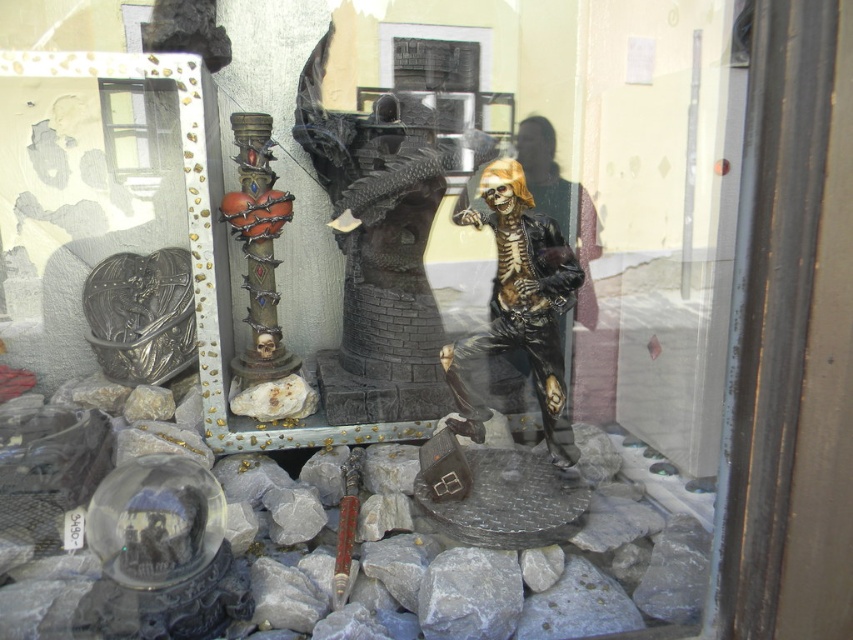
You are standing in front of the display case and want to touch both points in the scene. Which point, point [143,348] or point [277,300], will require you to reach further forward to touch it?

Point [277,300] will require reaching further forward because it is farther from the viewer compared to point [143,348].

You are a delivery person who needs to place a new item in the display case. The new item requires a space of at least 25 inches between the shiny gold skeleton at center and the shiny metallic column at center. Based on the scene description, can the new item be placed there?

The shiny gold skeleton at center is 25.65 inches from the shiny metallic column at center, so yes, the new item can be placed there since the required space of 25 inches is met.

You are a customer in a shop and want to buy the shiny gold skeleton at center and the shiny metallic column at center. The store has a special offer that allows you to take one item if its width is greater than the other. Which item should you choose to take advantage of the offer?

The shiny gold skeleton at center has a greater width than the shiny metallic column at center, so you should choose the shiny gold skeleton at center to take advantage of the offer.